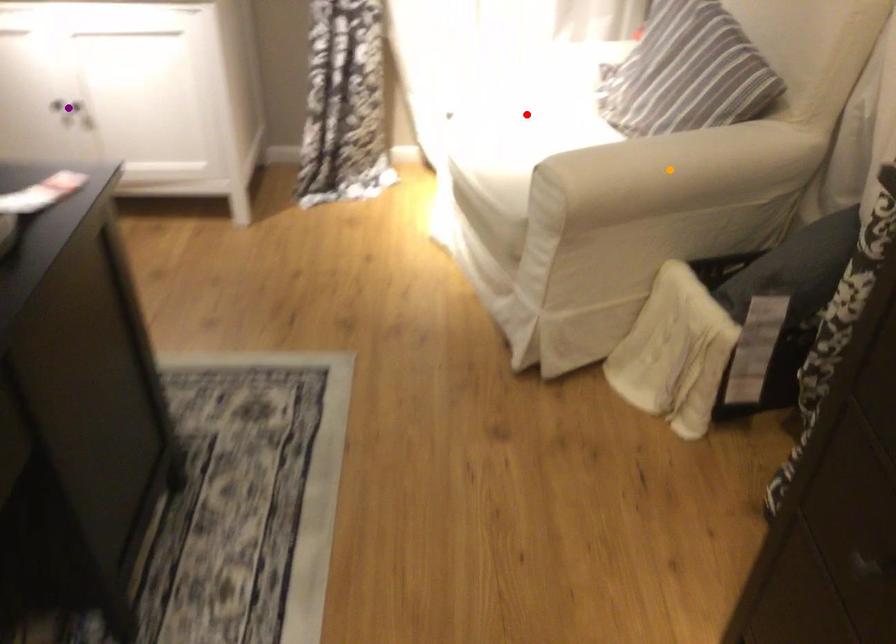
Order these from farthest to nearest:
purple point, red point, orange point

purple point < red point < orange point